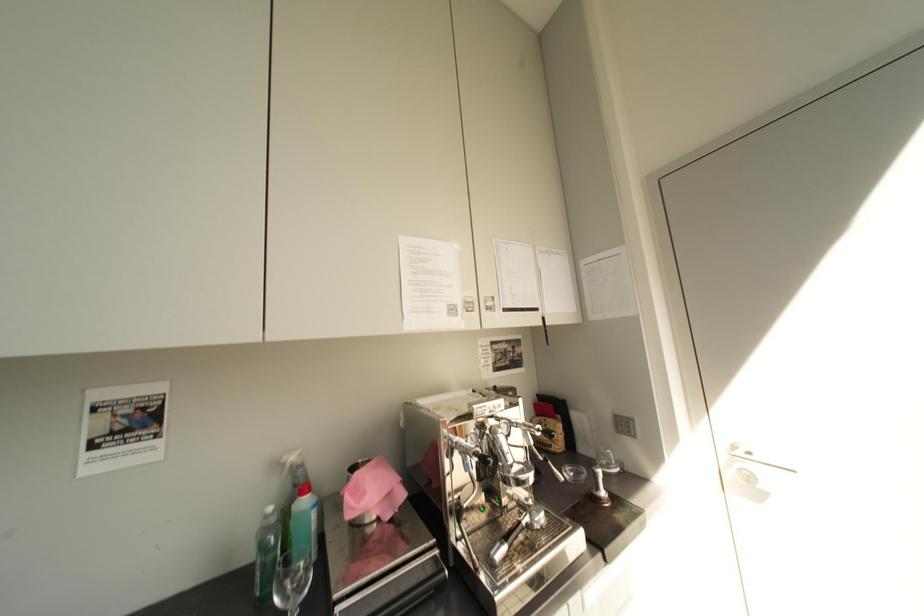
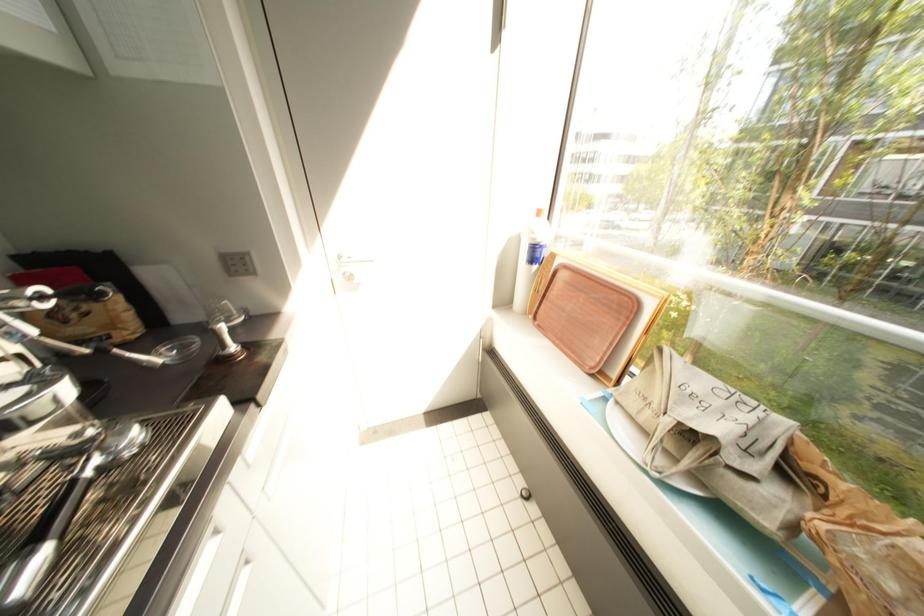
The first image is from the beginning of the video and the second image is from the end. How did the camera likely rotate when shooting the video?

The camera's rotation is toward right-down.